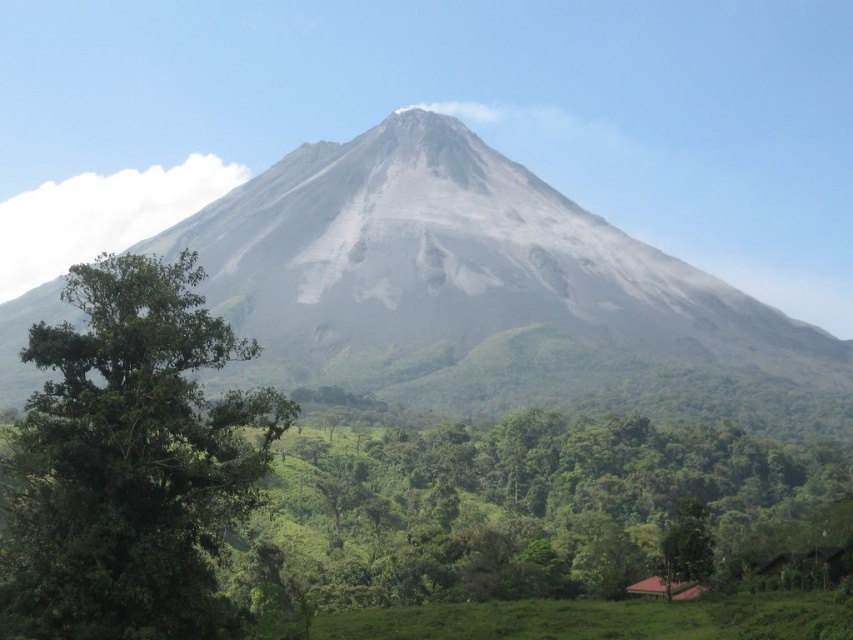
Can you confirm if green leafy tree at left is positioned to the right of green leafy tree at lower right?

Incorrect, green leafy tree at left is not on the right side of green leafy tree at lower right.

Does green leafy tree at left have a lesser width compared to green leafy tree at lower right?

No, green leafy tree at left is not thinner than green leafy tree at lower right.

This screenshot has width=853, height=640. What do you see at coordinates (131, 461) in the screenshot?
I see `green leafy tree at left` at bounding box center [131, 461].

The width and height of the screenshot is (853, 640). I want to click on green leafy tree at left, so click(x=131, y=461).

Is point (28, 384) positioned in front of point (80, 282)?

No, (28, 384) is further to viewer.

Who is higher up, gray/ashy mountain at center or green leafy tree at left?

gray/ashy mountain at center is higher up.

The height and width of the screenshot is (640, 853). What are the coordinates of `gray/ashy mountain at center` in the screenshot? It's located at (480, 289).

Find the location of `gray/ashy mountain at center`. gray/ashy mountain at center is located at coordinates (480, 289).

Is gray/ashy mountain at center to the left of green leafy tree at lower right from the viewer's perspective?

Indeed, gray/ashy mountain at center is positioned on the left side of green leafy tree at lower right.

Can you confirm if gray/ashy mountain at center is thinner than green leafy tree at lower right?

In fact, gray/ashy mountain at center might be wider than green leafy tree at lower right.

At what (x,y) coordinates should I click in order to perform the action: click on gray/ashy mountain at center. Please return your answer as a coordinate pair (x, y). Looking at the image, I should click on (480, 289).